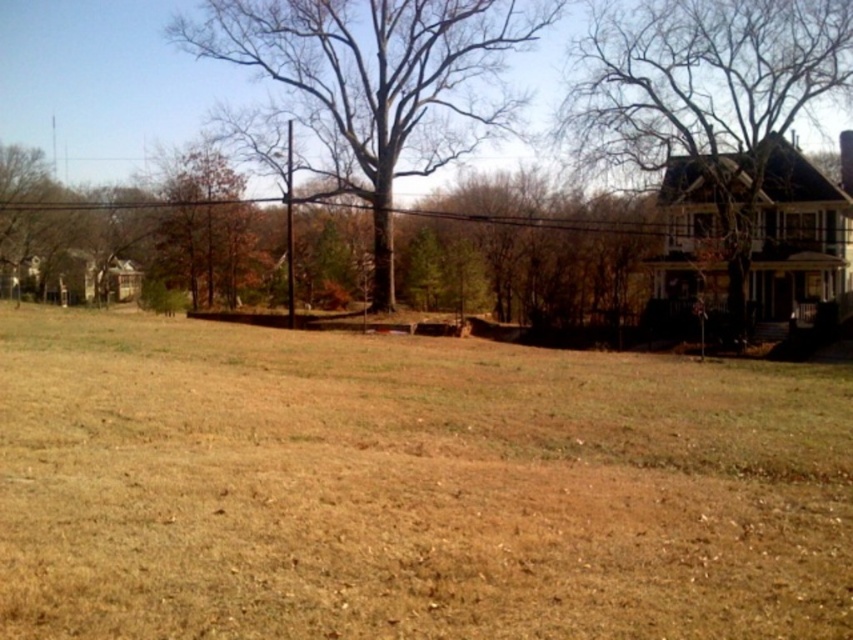
Question: Which point is closer to the camera?

Choices:
 (A) (593, 68)
 (B) (383, 240)
 (C) (494, 253)

Answer: (B)

Question: Among these points, which one is nearest to the camera?

Choices:
 (A) pyautogui.click(x=720, y=168)
 (B) pyautogui.click(x=300, y=92)
 (C) pyautogui.click(x=44, y=337)
 (D) pyautogui.click(x=496, y=269)

Answer: (C)

Question: Does bare wood tree at center have a larger size compared to bare branches at upper right?

Choices:
 (A) no
 (B) yes

Answer: (B)

Question: Does brown wooden fence at upper center have a greater width compared to bare wood tree at center?

Choices:
 (A) yes
 (B) no

Answer: (A)

Question: Estimate the real-world distances between objects in this image. Which object is closer to the brown wooden fence at upper center?

Choices:
 (A) bare branches at upper right
 (B) bare wood tree at center
 (C) brown grassy field at center

Answer: (A)

Question: From the image, what is the correct spatial relationship of brown grassy field at center in relation to bare wood tree at center?

Choices:
 (A) below
 (B) above

Answer: (A)